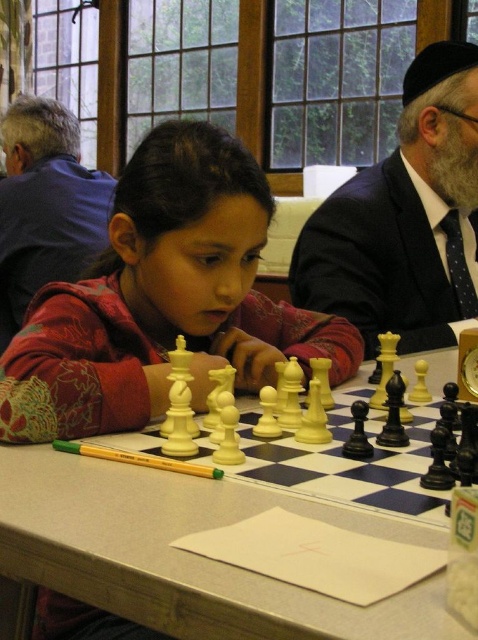
You are organizing a chess tournament and need to ensure that all chessboards fit on a table. Given that the white glossy chessboard at center is smaller than the matte blue shirt at upper left, can you determine which object takes up more space on the table?

The matte blue shirt at upper left occupies more space than the white glossy chessboard at center, so the shirt takes up more space on the table.

Where is the white glossy chessboard at center located in the image?

The white glossy chessboard at center is located at point (189, 554).

You are a chess player standing at the starting position. You need to place your chessboard exactly at point (x=189, y=554). Is the white glossy chessboard at center already placed correctly?

Yes, the white glossy chessboard at center is already placed correctly at point (x=189, y=554).